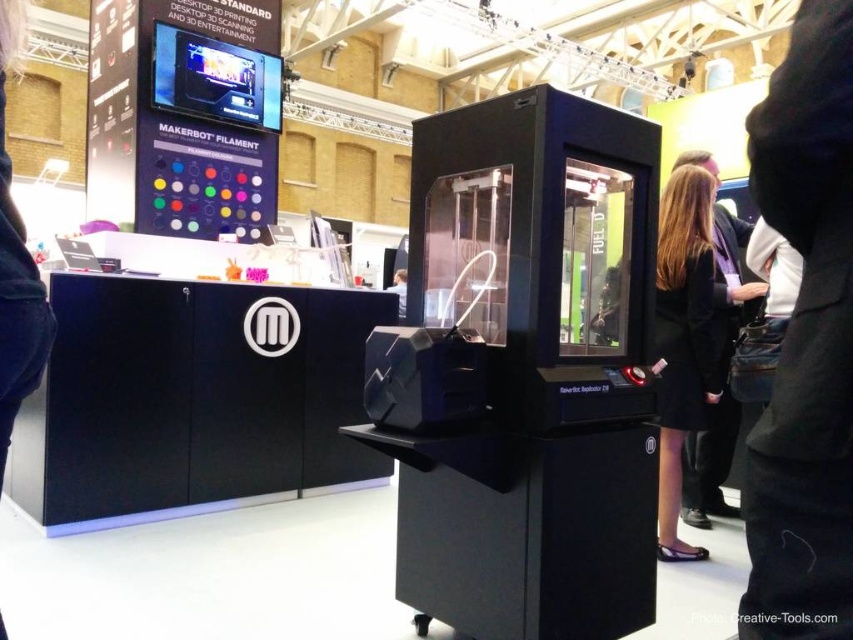
Question: Among these objects, which one is farthest from the camera?

Choices:
 (A) black fabric coat at right
 (B) black fabric coat at lower right
 (C) black fabric pants at lower right

Answer: (B)

Question: Does black fabric pants at lower right lie in front of black fabric coat at right?

Choices:
 (A) yes
 (B) no

Answer: (A)

Question: Does black fabric pants at lower right appear on the left side of black fabric coat at right?

Choices:
 (A) no
 (B) yes

Answer: (B)

Question: Based on their relative distances, which object is farther from the black fabric coat at lower right?

Choices:
 (A) black fabric pants at lower right
 (B) black fabric coat at right

Answer: (A)

Question: Which object is the closest to the black fabric pants at lower right?

Choices:
 (A) black fabric coat at right
 (B) black fabric coat at lower right

Answer: (A)

Question: Does black fabric pants at lower right appear over black fabric coat at right?

Choices:
 (A) no
 (B) yes

Answer: (B)